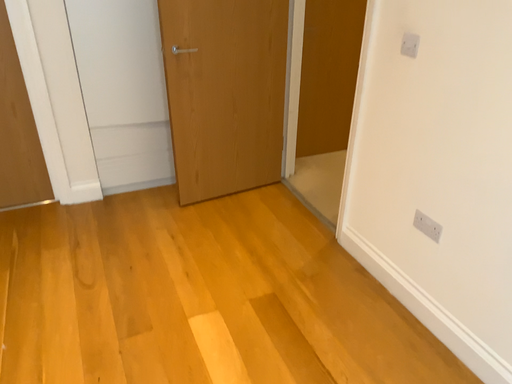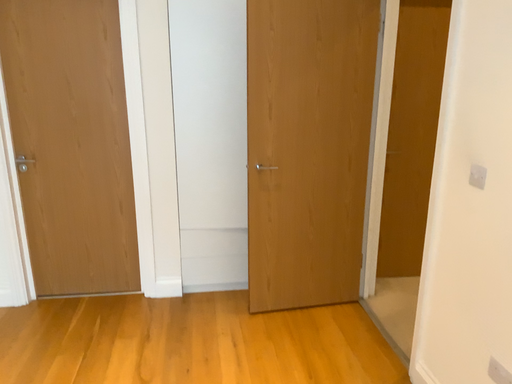
Question: How did the camera likely rotate when shooting the video?

Choices:
 (A) rotated downward
 (B) rotated upward

Answer: (B)